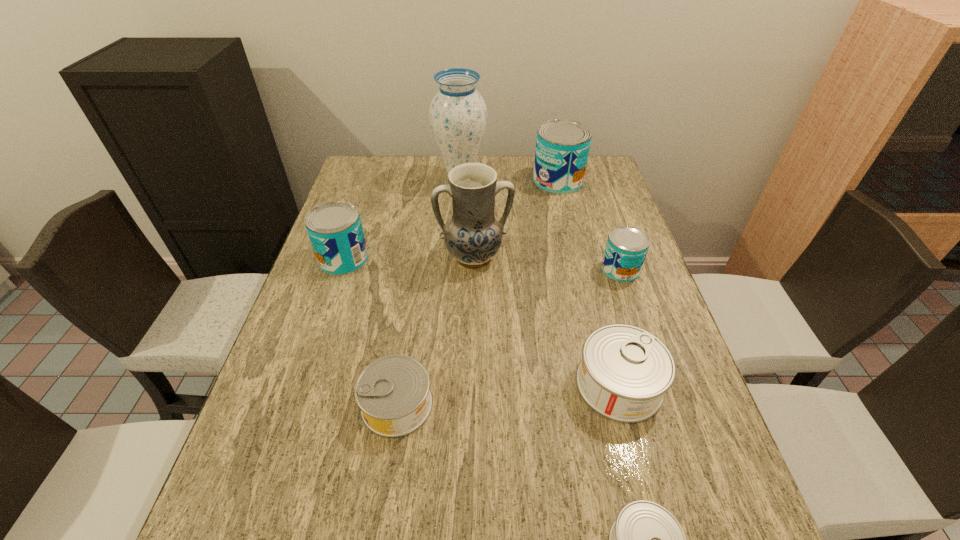
The height and width of the screenshot is (540, 960). What are the coordinates of `the tallest object` in the screenshot? It's located at (458, 114).

Locate an element on the screen. Image resolution: width=960 pixels, height=540 pixels. vase is located at coordinates click(x=458, y=114).

Where is `blue pottery`? The image size is (960, 540). blue pottery is located at coordinates (473, 235).

At what (x,y) coordinates should I click in order to perform the action: click on the seventh shortest object. Please return your answer as a coordinate pair (x, y). The image size is (960, 540). Looking at the image, I should click on (473, 235).

Locate an element on the screen. the biggest blue can is located at coordinates (562, 147).

Where is `the sixth shortest object`? The height and width of the screenshot is (540, 960). the sixth shortest object is located at coordinates (562, 147).

Image resolution: width=960 pixels, height=540 pixels. Find the location of `the leftmost object`. the leftmost object is located at coordinates (334, 228).

Where is `the leftmost blue can`? The height and width of the screenshot is (540, 960). the leftmost blue can is located at coordinates (334, 228).

I want to click on the smallest blue can, so click(x=626, y=248).

I want to click on the biggest silver can, so click(x=625, y=371).